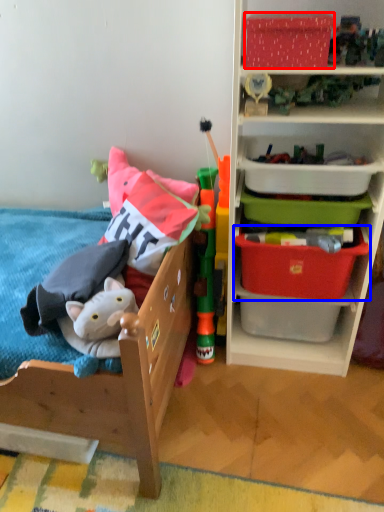
Question: Which object appears closest to the camera in this image, storage box (highlighted by a red box) or storage box (highlighted by a blue box)?

Choices:
 (A) storage box
 (B) storage box

Answer: (A)